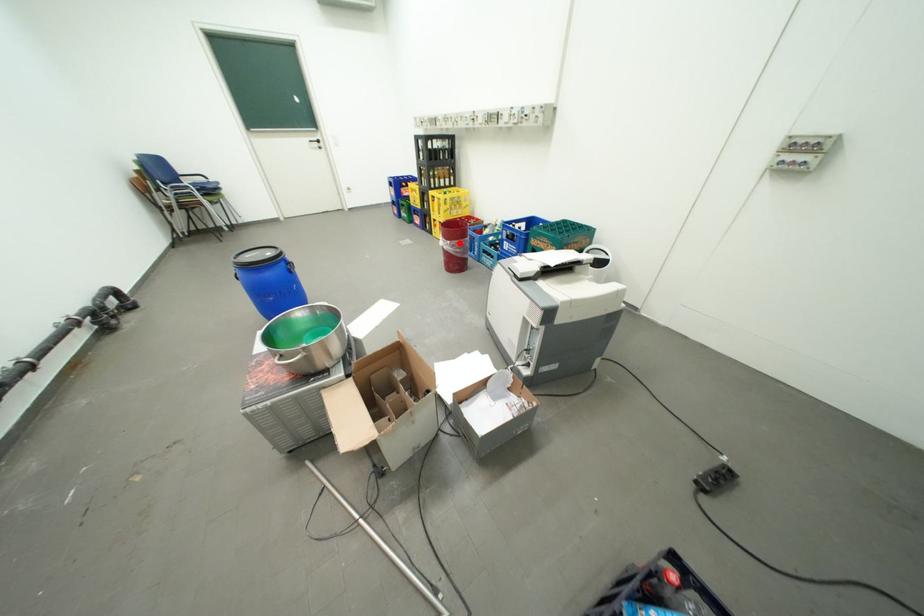
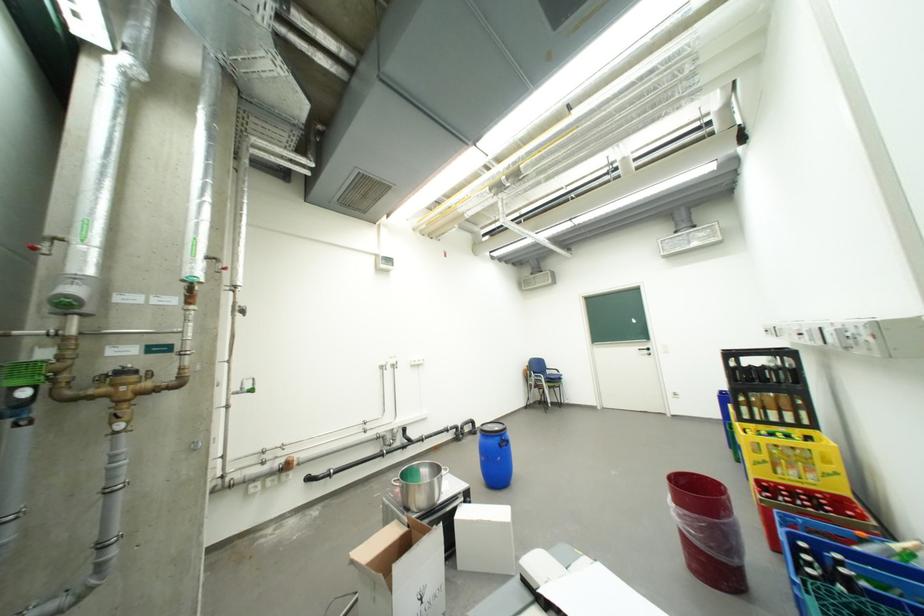
Question: A red point is marked in image1. In image2, is the corresponding 3D point closer to the camera or farther? Reply with the corresponding letter.

Choices:
 (A) The corresponding 3D point is closer.
 (B) The corresponding 3D point is farther.

Answer: (B)